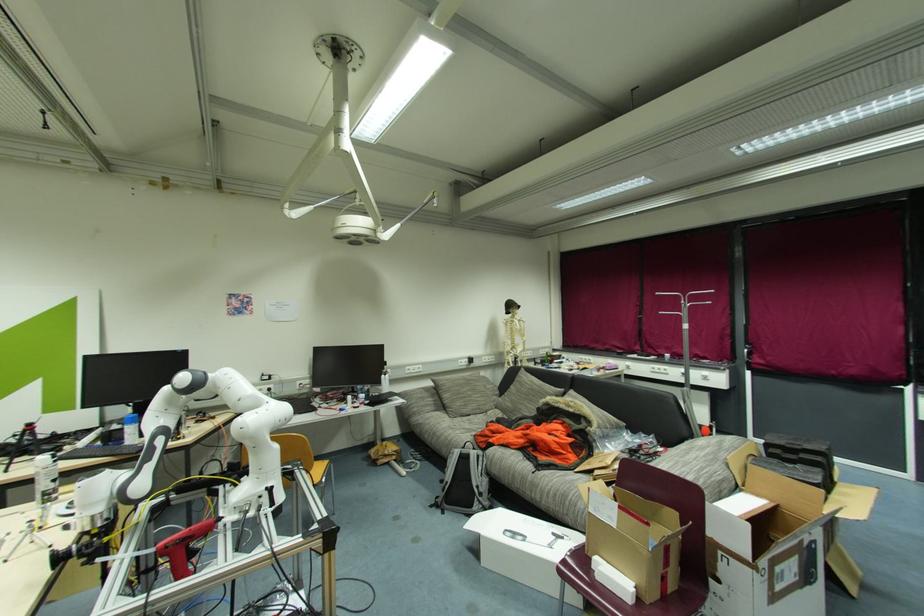
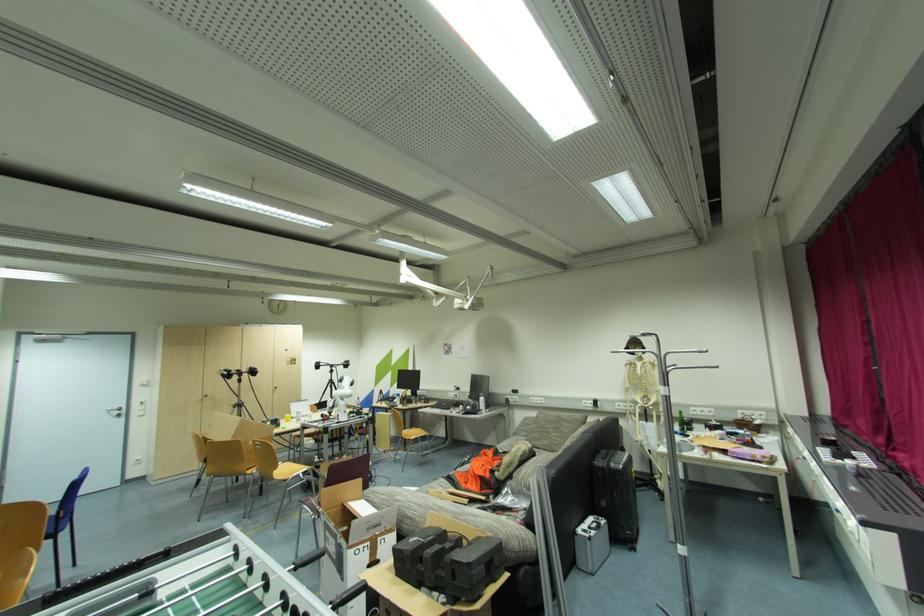
The point at [388,379] is marked in the first image. Where is the corresponding point in the second image?

(484, 400)